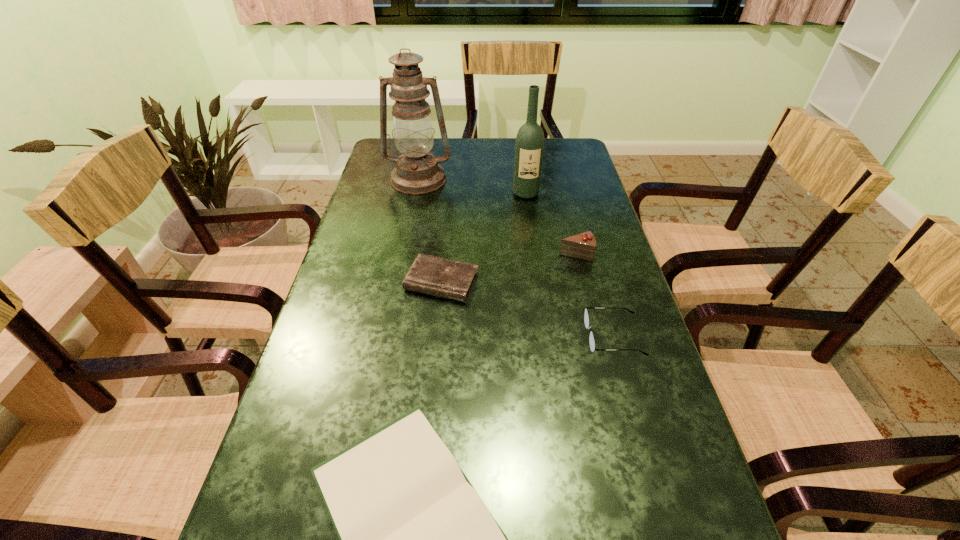
Locate which object is the third closest to the fourth farthest object. Please provide its 2D coordinates. Your answer should be formatted as a tuple, i.e. [(x, y)], where the tuple contains the x and y coordinates of a point satisfying the conditions above.

[(415, 539)]

You are a GUI agent. You are given a task and a screenshot of the screen. Output one action in this format:
    pyautogui.click(x=<x>, y=<y>)
    Task: Click on the object that is the fifth closest to the wine bottle
    
    Given the screenshot: What is the action you would take?
    pyautogui.click(x=415, y=539)

The image size is (960, 540). I want to click on free location that satisfies the following two spatial constraints: 1. on the labeled side of the third farthest object; 2. on the right side of the wine bottle, so click(x=534, y=254).